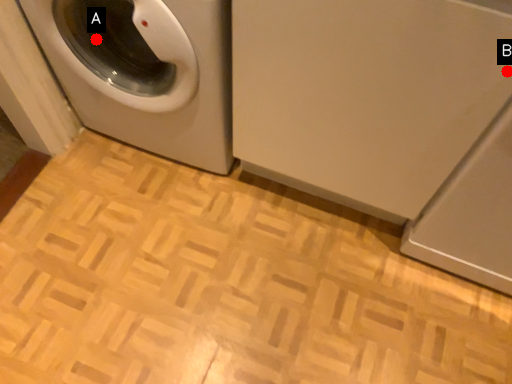
Question: Two points are circled on the image, labeled by A and B beside each circle. Which point is closer to the camera?

Choices:
 (A) A is closer
 (B) B is closer

Answer: (B)